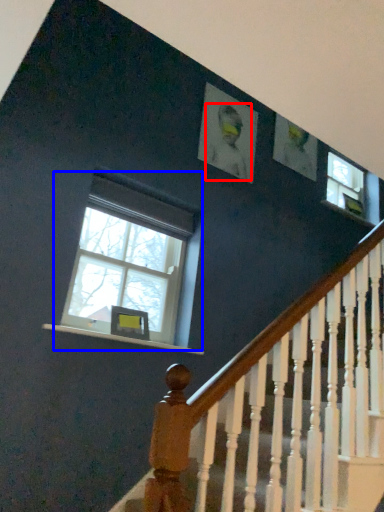
Question: Which object is further to the camera taking this photo, person (highlighted by a red box) or window (highlighted by a blue box)?

Choices:
 (A) person
 (B) window

Answer: (A)